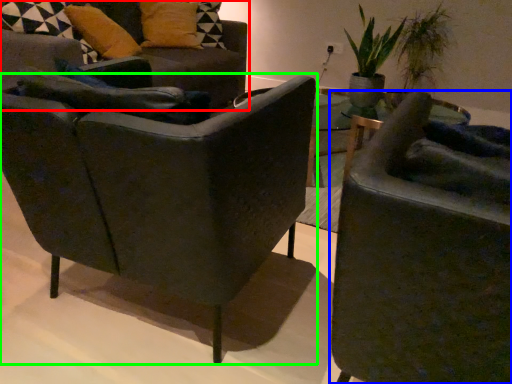
Question: Which object is positioned farthest from chair (highlighted by a red box)? Select from chair (highlighted by a blue box) and chair (highlighted by a green box).

Choices:
 (A) chair
 (B) chair

Answer: (A)